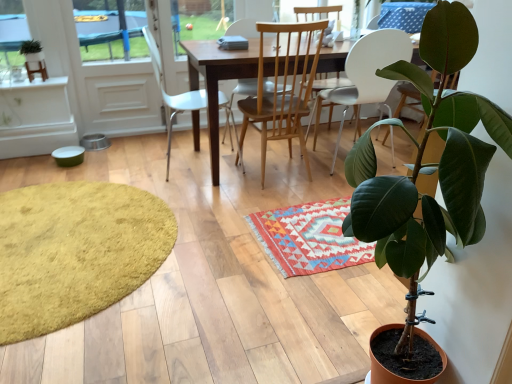
The image size is (512, 384). I want to click on empty space that is in between light wood/wooden chair at center, acting as the 2th chair starting from the left, and yellow shaggy rug at lower left, which ranks as the 1th mat in left-to-right order, so click(219, 208).